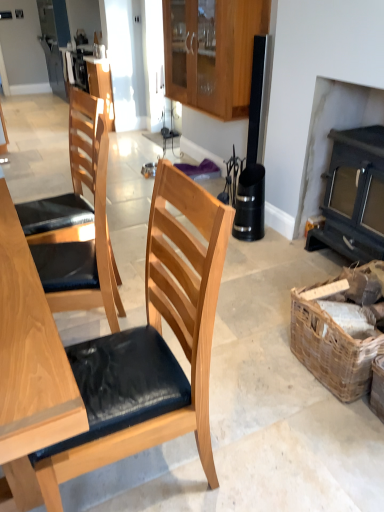
Locate an element on the screen. This screenshot has height=512, width=384. free space in front of woven brown picnic basket at lower right is located at coordinates (337, 435).